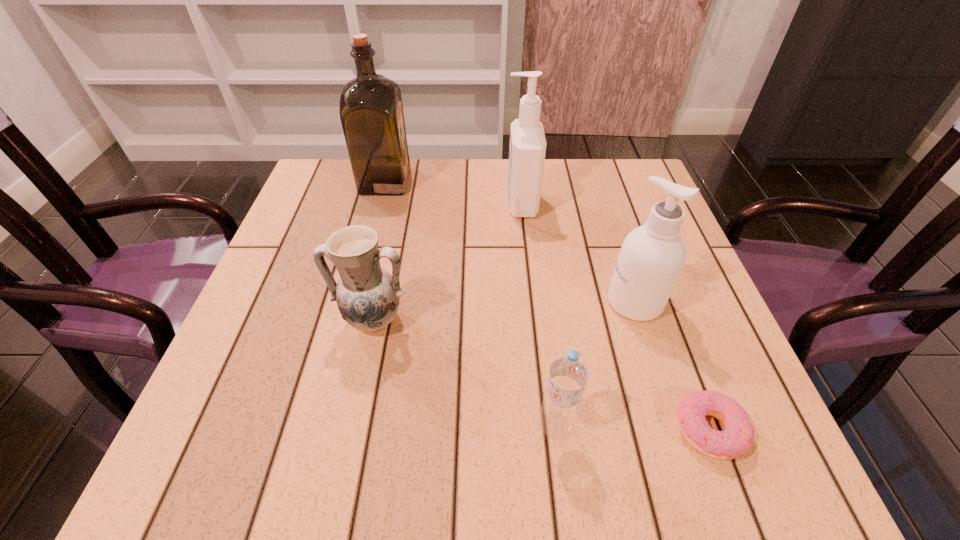
Identify the location of object that is the closest to the water bottle. Image resolution: width=960 pixels, height=540 pixels. (738, 436).

Locate an element on the screen. object that can be found as the closest to the nearer cleansing agent is located at coordinates (738, 436).

Identify the location of free space that satisfies the following two spatial constraints: 1. on the front label of the water bottle; 2. on the right side of the farther cleansing agent. The height and width of the screenshot is (540, 960). (544, 426).

Where is `free point that satisfies the following two spatial constraints: 1. on the back side of the water bottle; 2. on the label of the liquor`? This screenshot has height=540, width=960. free point that satisfies the following two spatial constraints: 1. on the back side of the water bottle; 2. on the label of the liquor is located at coordinates (525, 181).

The width and height of the screenshot is (960, 540). In order to click on vacant space that satisfies the following two spatial constraints: 1. on the back side of the shortest object; 2. on the label of the liquor in this screenshot , I will do `click(615, 181)`.

Locate an element on the screen. vacant space that satisfies the following two spatial constraints: 1. on the back side of the shortest object; 2. on the label of the liquor is located at coordinates (615, 181).

Where is `free region that satisfies the following two spatial constraints: 1. on the front label of the left cleansing agent; 2. on the right side of the doughnut`? This screenshot has height=540, width=960. free region that satisfies the following two spatial constraints: 1. on the front label of the left cleansing agent; 2. on the right side of the doughnut is located at coordinates (544, 430).

The height and width of the screenshot is (540, 960). What are the coordinates of `blank space that satisfies the following two spatial constraints: 1. on either side of the doughnut; 2. on the left side of the pottery` in the screenshot? It's located at (349, 430).

The width and height of the screenshot is (960, 540). Find the location of `free spot that satisfies the following two spatial constraints: 1. on either side of the pottery; 2. on the left side of the water bottle`. free spot that satisfies the following two spatial constraints: 1. on either side of the pottery; 2. on the left side of the water bottle is located at coordinates (350, 426).

This screenshot has width=960, height=540. I want to click on blank area in the image that satisfies the following two spatial constraints: 1. on the front label of the nearer cleansing agent; 2. on the right side of the doughnut, so click(x=676, y=430).